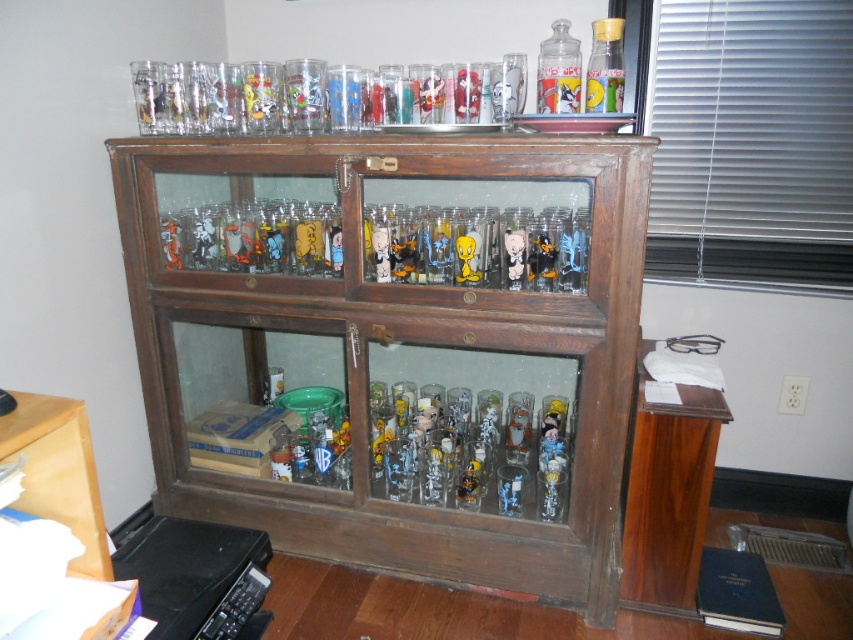
I want to click on clear glass bottle at upper right, so click(x=605, y=67).

I want to click on clear glass bottle at upper right, so click(x=605, y=67).

Which is more to the left, translucent glass figurine at center or wooden desk at lower left?

From the viewer's perspective, wooden desk at lower left appears more on the left side.

Is translucent glass figurine at center taller than wooden desk at lower left?

In fact, translucent glass figurine at center may be shorter than wooden desk at lower left.

This screenshot has height=640, width=853. I want to click on translucent glass figurine at center, so click(254, 237).

Is clear glass cabinet at upper center to the right of clear glass bottle at upper right from the viewer's perspective?

Incorrect, clear glass cabinet at upper center is not on the right side of clear glass bottle at upper right.

Can you confirm if clear glass cabinet at upper center is positioned to the left of clear glass bottle at upper right?

Indeed, clear glass cabinet at upper center is positioned on the left side of clear glass bottle at upper right.

Is point (296, 372) positioned behind point (622, 81)?

Yes, point (296, 372) is behind point (622, 81).

The image size is (853, 640). In order to click on clear glass cabinet at upper center in this screenshot , I will do `click(395, 346)`.